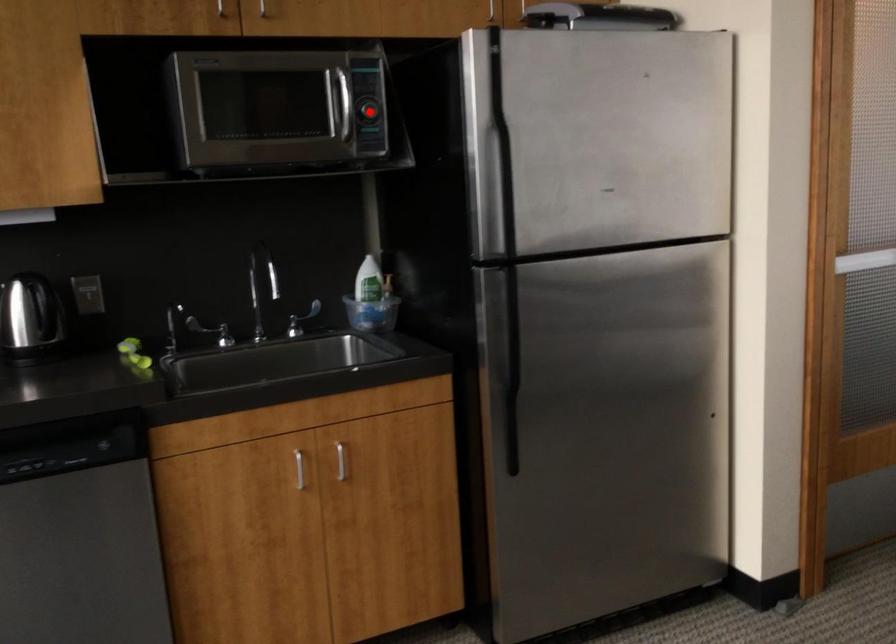
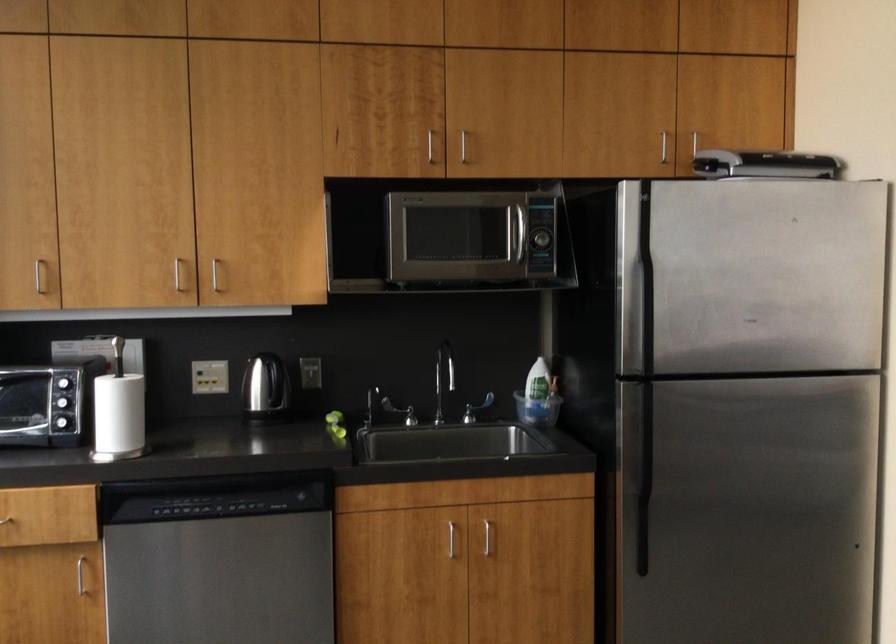
Question: I am providing you with two images of the same scene from different viewpoints. In image1, a red point is highlighted. Considering the same 3D point in image2, which of the following is correct?

Choices:
 (A) It is closer
 (B) It is farther

Answer: (B)